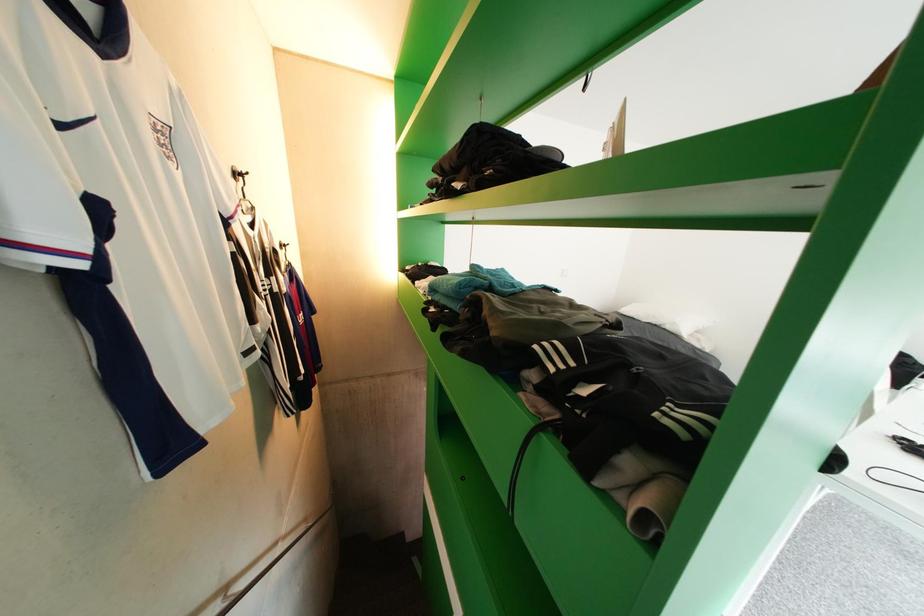
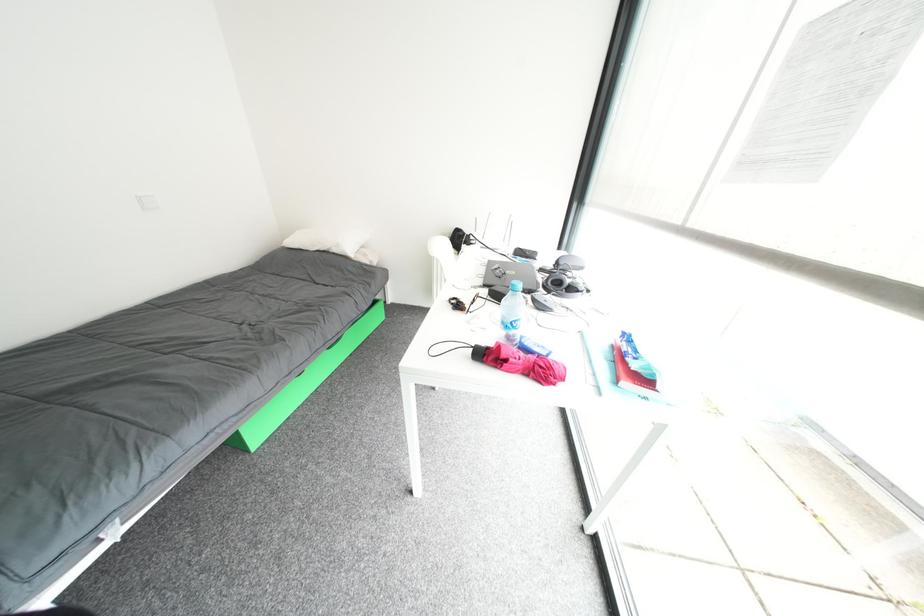
Based on the continuous images, in which direction is the camera rotating?

The rotation direction of the camera is right-down.